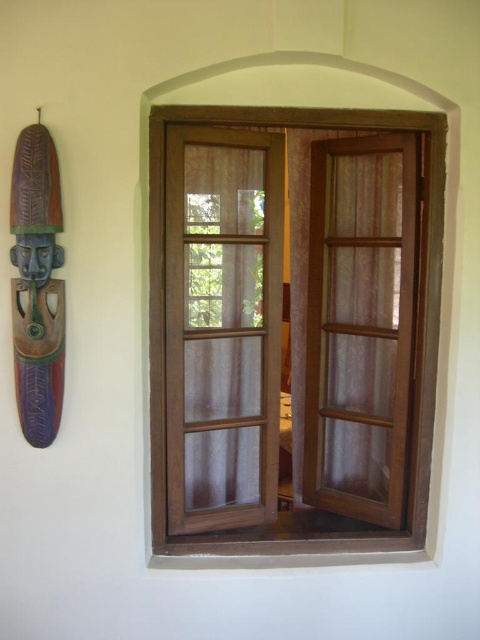
Question: Which object is the farthest from the brown wood window at center?

Choices:
 (A) sheer fabric curtain at right
 (B) translucent sheer curtain at center

Answer: (A)

Question: Can you confirm if translucent sheer curtain at center is positioned below sheer fabric curtain at right?

Choices:
 (A) yes
 (B) no

Answer: (A)

Question: Can you confirm if translucent sheer curtain at center is positioned below brown wood window at center?

Choices:
 (A) yes
 (B) no

Answer: (B)

Question: Which object is the farthest from the brown wood window at center?

Choices:
 (A) sheer fabric curtain at right
 (B) translucent sheer curtain at center

Answer: (A)

Question: Observing the image, what is the correct spatial positioning of sheer fabric curtain at right in reference to brown wood window at center?

Choices:
 (A) above
 (B) below

Answer: (A)

Question: Estimate the real-world distances between objects in this image. Which object is farther from the translucent sheer curtain at center?

Choices:
 (A) sheer fabric curtain at right
 (B) brown wood window at center

Answer: (A)